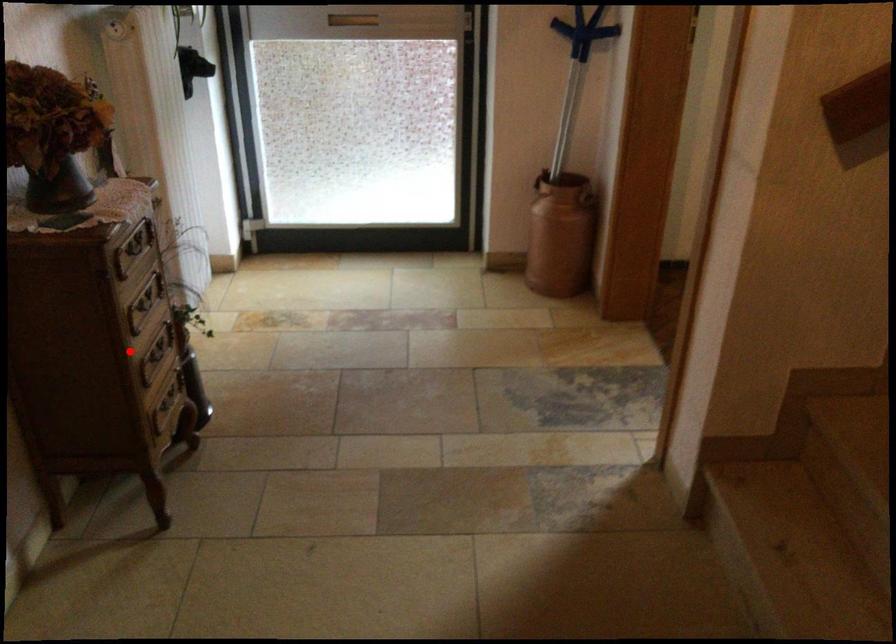
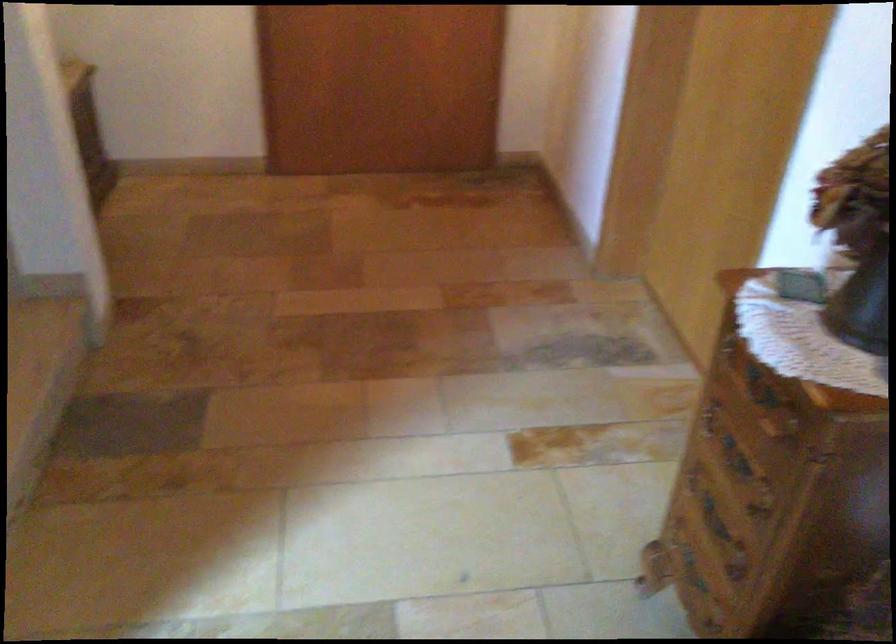
Where in the second image is the point corresponding to the highlighted location from the first image?

(735, 457)